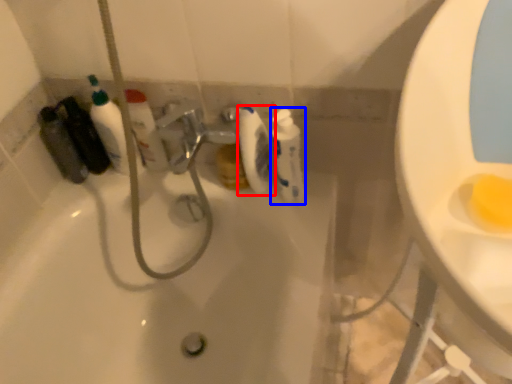
Question: Which object is closer to the camera taking this photo, toilet paper (highlighted by a red box) or cleaning product (highlighted by a blue box)?

Choices:
 (A) toilet paper
 (B) cleaning product

Answer: (B)